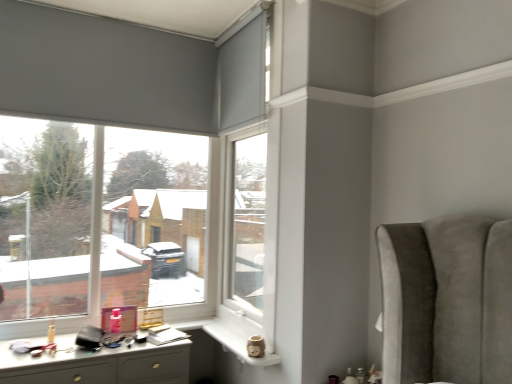
Question: Considering the relative positions of white plastic window frame at center and white ceramic mug at lower center in the image provided, is white plastic window frame at center to the right of white ceramic mug at lower center from the viewer's perspective?

Choices:
 (A) no
 (B) yes

Answer: (B)

Question: Is white plastic window frame at center facing towards white ceramic mug at lower center?

Choices:
 (A) yes
 (B) no

Answer: (B)

Question: From a real-world perspective, is white plastic window frame at center located higher than white ceramic mug at lower center?

Choices:
 (A) yes
 (B) no

Answer: (A)

Question: Does white plastic window frame at center have a greater width compared to white ceramic mug at lower center?

Choices:
 (A) no
 (B) yes

Answer: (A)

Question: Does white plastic window frame at center have a larger size compared to white ceramic mug at lower center?

Choices:
 (A) yes
 (B) no

Answer: (A)

Question: Are white plastic window frame at center and white ceramic mug at lower center located far from each other?

Choices:
 (A) yes
 (B) no

Answer: (B)

Question: Can you confirm if matte gray roller blind at left is bigger than white glossy desk at lower left?

Choices:
 (A) yes
 (B) no

Answer: (A)

Question: Is matte gray roller blind at left touching white glossy desk at lower left?

Choices:
 (A) no
 (B) yes

Answer: (A)

Question: Is matte gray roller blind at left located outside white glossy desk at lower left?

Choices:
 (A) no
 (B) yes

Answer: (B)

Question: Does matte gray roller blind at left turn towards white glossy desk at lower left?

Choices:
 (A) no
 (B) yes

Answer: (A)

Question: Does matte gray roller blind at left have a lesser height compared to white glossy desk at lower left?

Choices:
 (A) no
 (B) yes

Answer: (A)

Question: Does matte gray roller blind at left lie in front of white glossy desk at lower left?

Choices:
 (A) no
 (B) yes

Answer: (A)

Question: Does white plastic window frame at center have a greater width compared to white glossy desk at lower left?

Choices:
 (A) yes
 (B) no

Answer: (B)